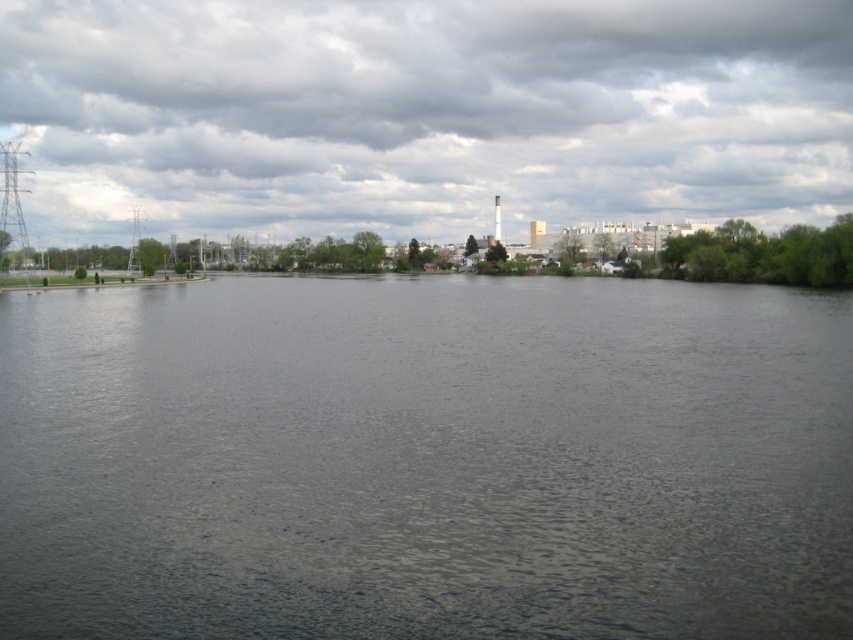
You are standing on the shore of the lake and notice the dark gray water at center and the dark cloudy sky at upper center. Which object is positioned to the right of the other?

The dark gray water at center is to the right of the dark cloudy sky at upper center.

Looking at this image, you are an architect designing a new observation deck that needs to have a clear view of both the dark gray water at center and the dark cloudy sky at upper center. Given their sizes, which object will require a larger viewing area in the deck design?

The dark cloudy sky at upper center requires a larger viewing area because it is bigger than the dark gray water at center.